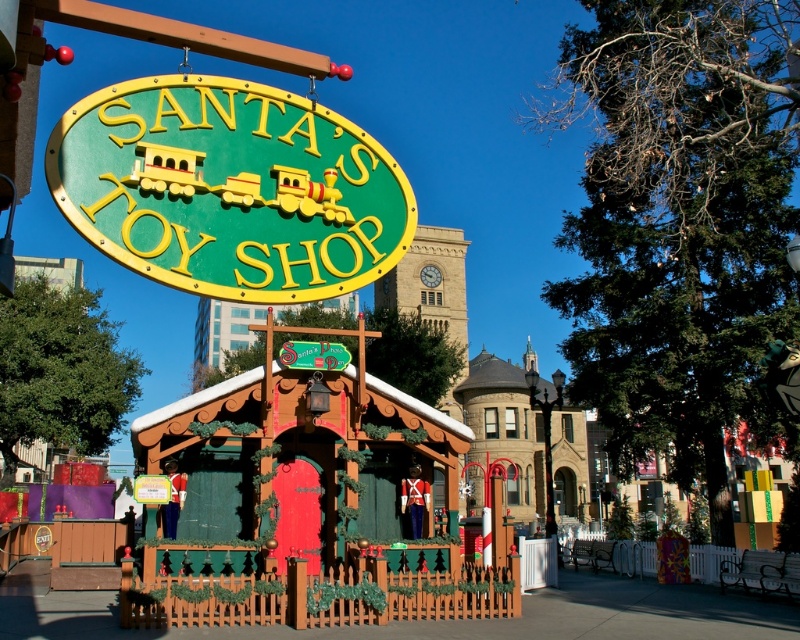
Is wooden cabin at center wider than green plastic sign at center?

Indeed, wooden cabin at center has a greater width compared to green plastic sign at center.

Does wooden cabin at center have a smaller size compared to green plastic sign at center?

Actually, wooden cabin at center might be larger than green plastic sign at center.

Does point (432, 452) come closer to viewer compared to point (332, 346)?

No, (432, 452) is further to viewer.

This screenshot has height=640, width=800. I want to click on wooden cabin at center, so click(308, 506).

Can you confirm if green matte sign at upper center is smaller than green plastic sign at center?

No, green matte sign at upper center is not smaller than green plastic sign at center.

Who is lower down, green matte sign at upper center or green plastic sign at center?

green plastic sign at center

The image size is (800, 640). What do you see at coordinates (229, 188) in the screenshot?
I see `green matte sign at upper center` at bounding box center [229, 188].

Where is `green matte sign at upper center`? green matte sign at upper center is located at coordinates (229, 188).

Is wooden cabin at center closer to the viewer compared to green matte sign at upper center?

No, wooden cabin at center is behind green matte sign at upper center.

Is point (200, 608) positioned after point (222, 81)?

Yes.

You are a GUI agent. You are given a task and a screenshot of the screen. Output one action in this format:
    pyautogui.click(x=<x>, y=<y>)
    Task: Click on the wooden cabin at center
    Image resolution: width=800 pixels, height=640 pixels.
    Given the screenshot: What is the action you would take?
    pyautogui.click(x=308, y=506)